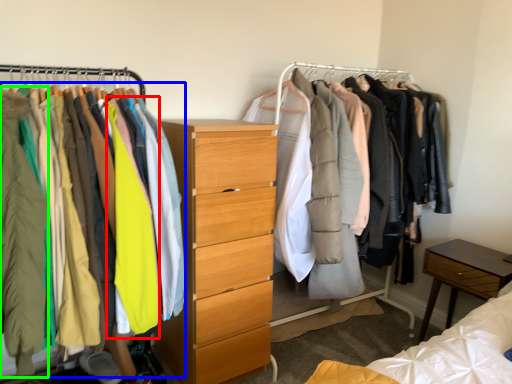
Question: Which is farther away from clothing (highlighted by a red box)? clothing (highlighted by a blue box) or clothing (highlighted by a green box)?

Choices:
 (A) clothing
 (B) clothing

Answer: (B)